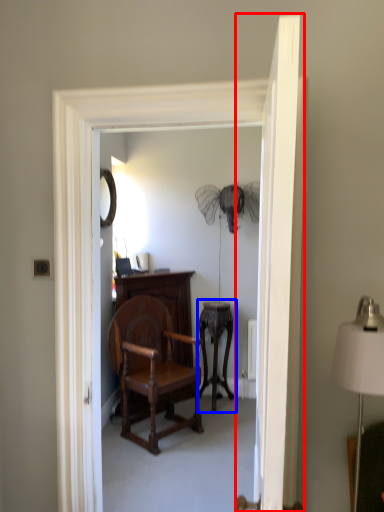
Question: Which of the following is the closest to the observer, door (highlighted by a red box) or side table (highlighted by a blue box)?

Choices:
 (A) door
 (B) side table

Answer: (A)